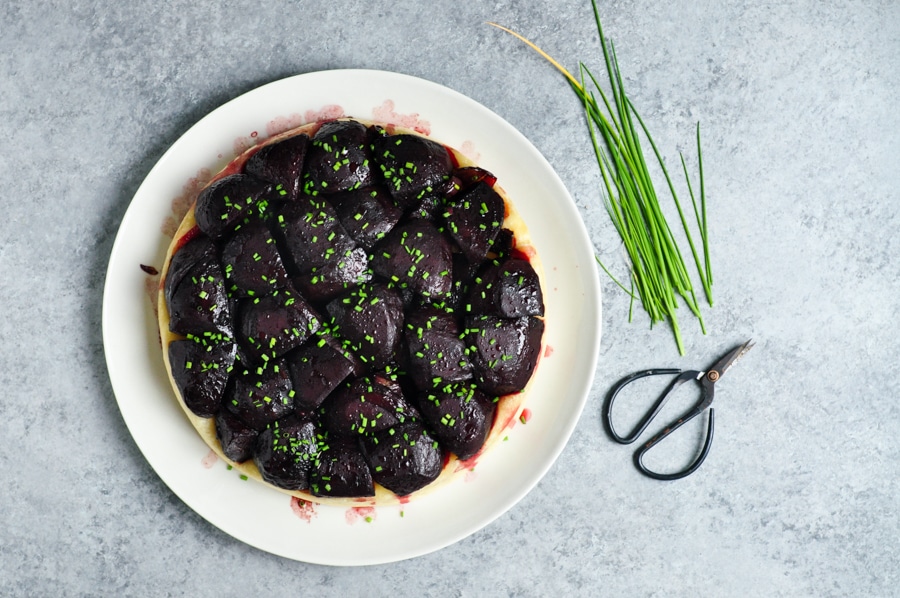
Locate an element on the screen. The image size is (900, 598). counter is located at coordinates (814, 115).